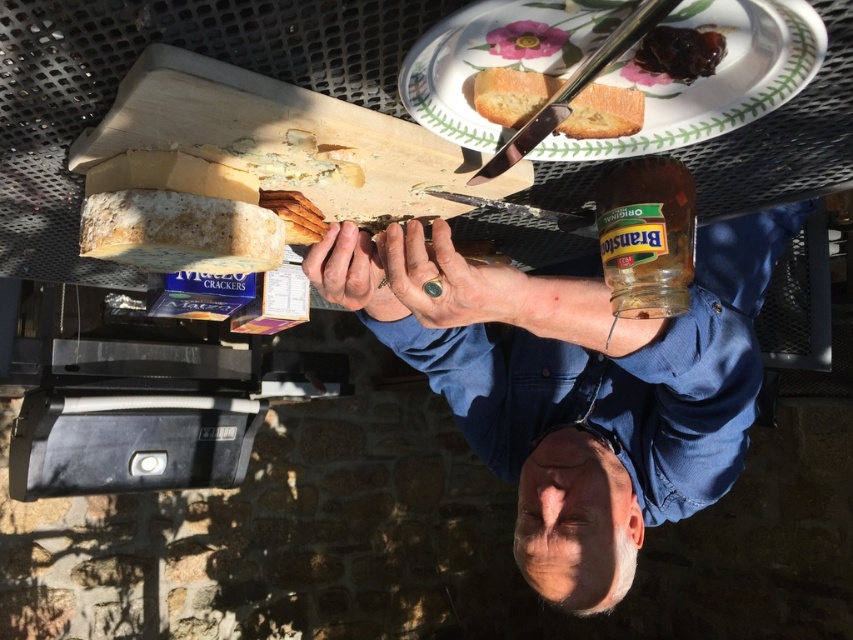
Who is taller, golden brown crusty bread at upper center or dry skin at center?

dry skin at center

Does point (605, 100) lie behind point (314, 257)?

That is False.

At what (x,y) coordinates should I click in order to perform the action: click on golden brown crusty bread at upper center. Please return your answer as a coordinate pair (x, y). The height and width of the screenshot is (640, 853). Looking at the image, I should click on (511, 93).

I want to click on white crumbly cheese at center, so click(180, 230).

Does point (271, 262) come closer to viewer compared to point (471, 310)?

That is False.

Between point (178, 237) and point (518, 314), which one is positioned behind?

Positioned behind is point (518, 314).

The width and height of the screenshot is (853, 640). I want to click on white crumbly cheese at center, so click(180, 230).

Can you confirm if clear glass jar at center is wider than dry skin at center?

Correct, the width of clear glass jar at center exceeds that of dry skin at center.

From the picture: Can you confirm if clear glass jar at center is smaller than dry skin at center?

No.

At what (x,y) coordinates should I click in order to perform the action: click on clear glass jar at center. Please return your answer as a coordinate pair (x, y). The height and width of the screenshot is (640, 853). Looking at the image, I should click on (646, 236).